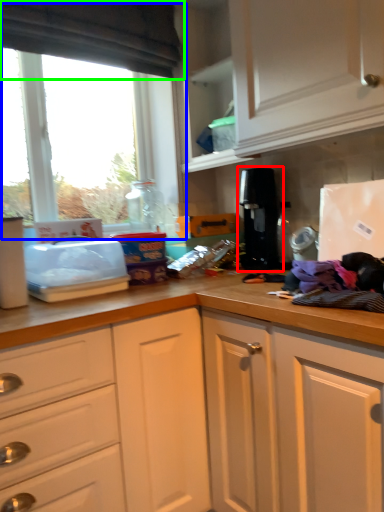
Question: Estimate the real-world distances between objects in this image. Which object is closer to coffee machine (highlighted by a red box), window (highlighted by a blue box) or exhaust hood (highlighted by a green box)?

Choices:
 (A) window
 (B) exhaust hood

Answer: (A)